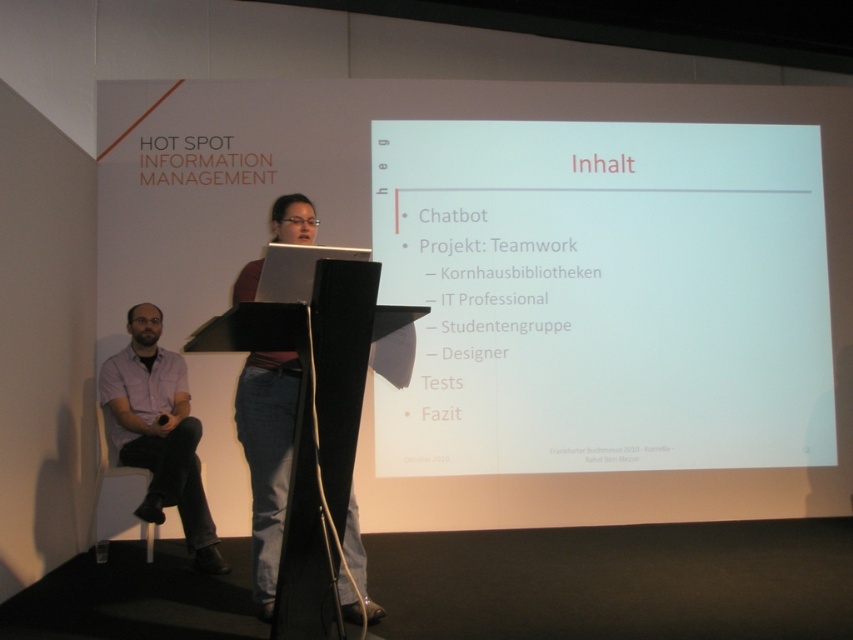
Based on the photo, you are an attendee at the presentation and need to take a photo of the white matte projector screen at center and the purple shirt at left. Which one would you need to zoom in more on to capture clearly?

The purple shirt at left requires more zoom because it is smaller than the white matte projector screen at center.

You are organizing a presentation and need to ensure that the white matte projector screen at center is visible to everyone in the room. Considering the purple shirt at left is occupied by an attendee, is the screen likely positioned in a way that avoids blocking the attendee?

The white matte projector screen at center might be wider than purple shirt at left, so it is possible that the screen is positioned to avoid blocking the attendee wearing the purple shirt at left. However, without exact measurements, this cannot be confirmed with certainty.